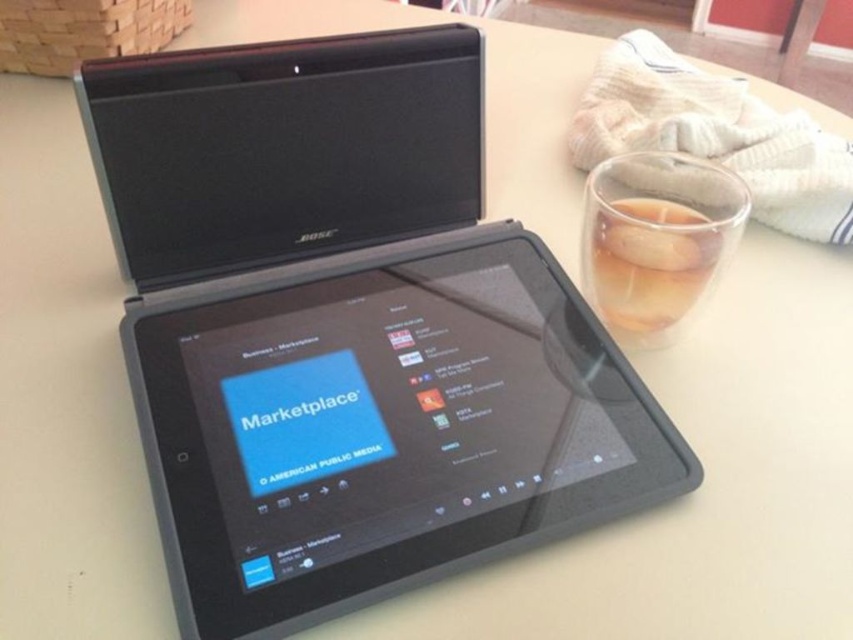
Question: From the image, what is the correct spatial relationship of black matte tablet at center in relation to translucent glass cup at right?

Choices:
 (A) left
 (B) right

Answer: (A)

Question: From the image, what is the correct spatial relationship of black matte tablet at center in relation to translucent glass cup at right?

Choices:
 (A) above
 (B) below

Answer: (B)

Question: Is black matte tablet at center positioned in front of translucent glass cup at right?

Choices:
 (A) no
 (B) yes

Answer: (B)

Question: Among these points, which one is farthest from the camera?

Choices:
 (A) (x=717, y=228)
 (B) (x=582, y=385)

Answer: (B)

Question: Which point is closer to the camera taking this photo?

Choices:
 (A) (207, 602)
 (B) (587, 180)

Answer: (A)